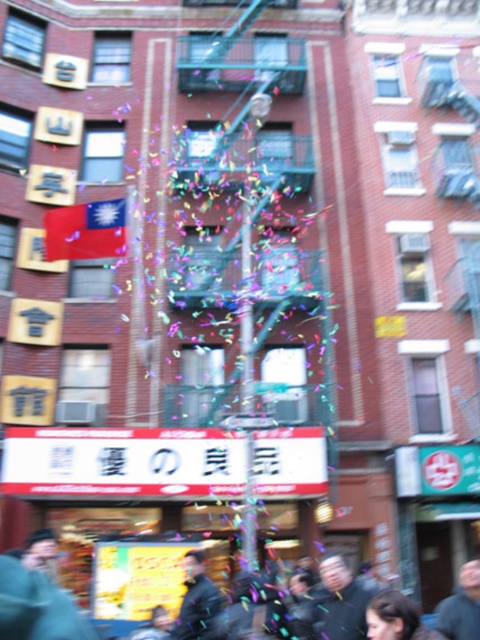
Question: Is dark gray leather jacket at center to the right of dark brown hair at center from the viewer's perspective?

Choices:
 (A) no
 (B) yes

Answer: (A)

Question: Does dark gray jacket at center appear over dark brown hair at center?

Choices:
 (A) yes
 (B) no

Answer: (B)

Question: Among these objects, which one is farthest from the camera?

Choices:
 (A) dark gray leather jacket at center
 (B) dark blue fabric at center
 (C) dark brown hair at center

Answer: (A)

Question: Does dark gray jacket at center lie in front of dark brown hair at center?

Choices:
 (A) yes
 (B) no

Answer: (B)

Question: Which point is farther from the camera taking this photo?

Choices:
 (A) (331, 600)
 (B) (370, 602)
 (C) (467, 588)
 (D) (201, 588)

Answer: (D)

Question: Which point is farther to the camera?

Choices:
 (A) dark gray leather jacket at center
 (B) dark brown hair at center
 (C) dark blue fabric at center
 (D) dark gray jacket at center

Answer: (A)